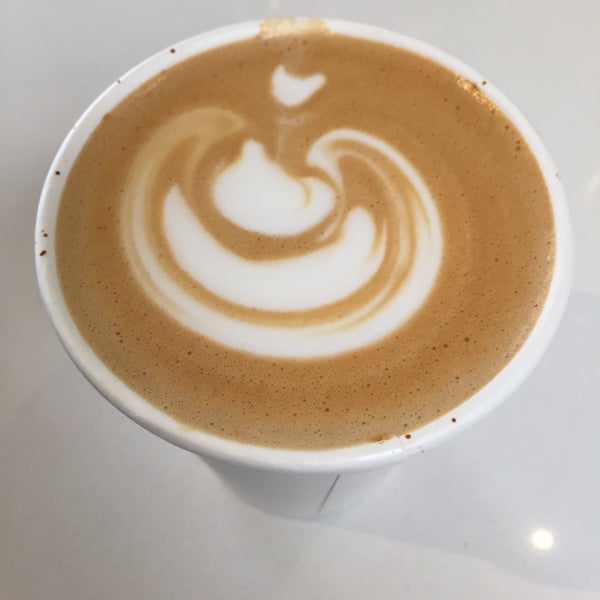
Identify the location of cup of coffee. (405, 116), (236, 388), (260, 183), (456, 326), (304, 493), (362, 482), (245, 482).